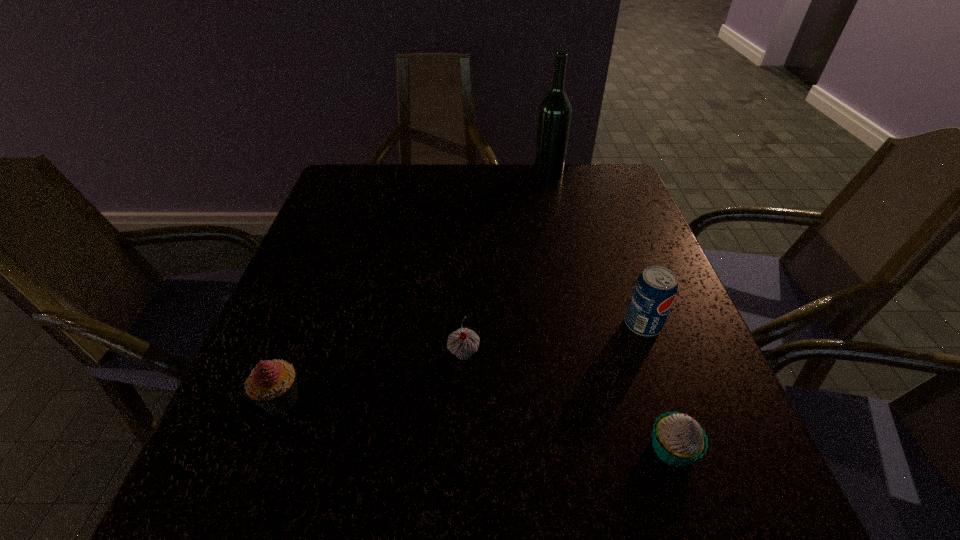
Locate an element on the screen. alcohol is located at coordinates (554, 117).

What are the coordinates of `the farthest object` in the screenshot? It's located at (554, 117).

The image size is (960, 540). Identify the location of pop. (655, 290).

Locate an element on the screen. the fourth nearest object is located at coordinates (655, 290).

At what (x,y) coordinates should I click in order to perform the action: click on the leftmost object. Please return your answer as a coordinate pair (x, y). Image resolution: width=960 pixels, height=540 pixels. Looking at the image, I should click on (272, 385).

Locate an element on the screen. the second farthest cupcake is located at coordinates (272, 385).

Where is `the third nearest object`? This screenshot has height=540, width=960. the third nearest object is located at coordinates (463, 342).

Locate an element on the screen. the second cupcake from left to right is located at coordinates tap(463, 342).

You are a GUI agent. You are given a task and a screenshot of the screen. Output one action in this format:
    pyautogui.click(x=<x>, y=<y>)
    Task: Click on the nearest cupcake
    
    Given the screenshot: What is the action you would take?
    pyautogui.click(x=678, y=439)

The width and height of the screenshot is (960, 540). In order to click on the nearest object in this screenshot , I will do `click(678, 439)`.